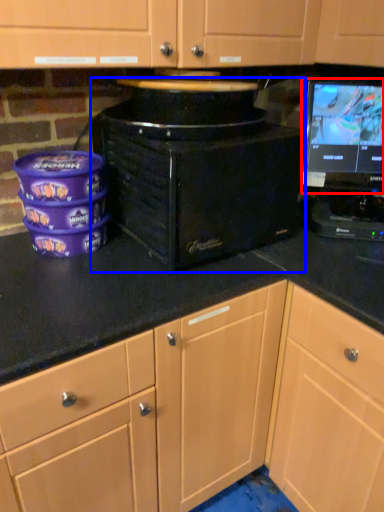
Question: Which object appears farthest to the camera in this image, computer monitor (highlighted by a red box) or home appliance (highlighted by a blue box)?

Choices:
 (A) computer monitor
 (B) home appliance

Answer: (A)